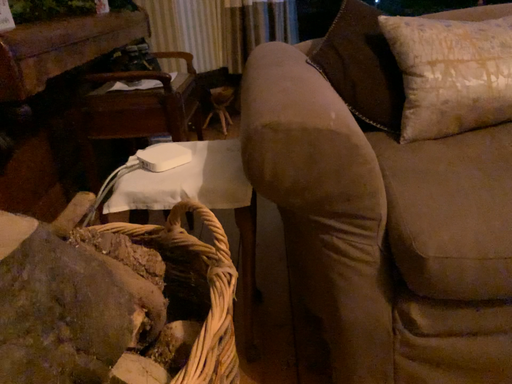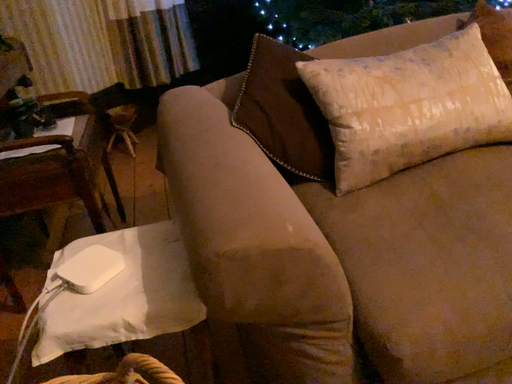
Question: Which way did the camera rotate in the video?

Choices:
 (A) rotated left
 (B) rotated right

Answer: (B)